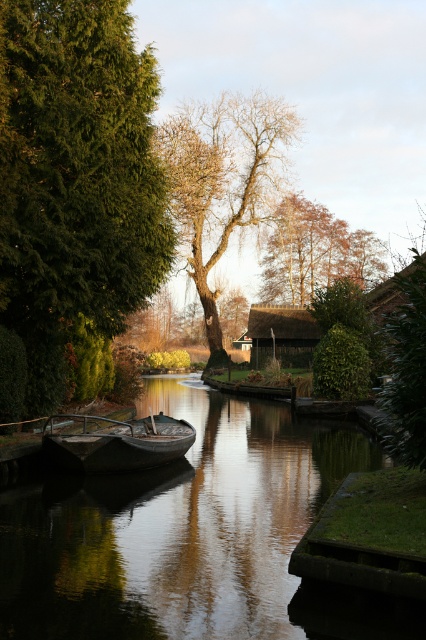
You are a bird flying over the canal scene and want to land on the highest point between the bare wood tree at center and the thatched wood hut at center. Which one should you choose?

The bare wood tree at center is above the thatched wood hut at center, so you should choose the bare wood tree at center to land on the highest point.

You are standing at the edge of the canal and want to walk directly towards the bare wood tree at center. Which direction should you head?

Since the bare wood tree at center is located at coordinates 0.280 on the x axis and 0.521 on the y axis, you should head towards the center of the image to reach it.

You are a delivery drone with a maximum flight range of 150 feet. You need to deliver a package from the wooden boat at center to the thatched wood hut at center. Can you complete the delivery without needing a recharge?

The distance between wooden boat at center and thatched wood hut at center is 139.97 feet, which is within your 150 feet flight range. Yes, you can complete the delivery without needing a recharge.